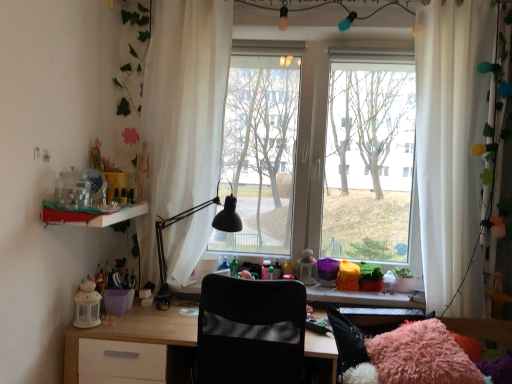
This screenshot has width=512, height=384. What do you see at coordinates (251, 332) in the screenshot?
I see `black mesh chair at center` at bounding box center [251, 332].

Locate an element on the screen. matte plastic shelf at left is located at coordinates (93, 216).

You are a GUI agent. You are given a task and a screenshot of the screen. Output one action in this format:
    pyautogui.click(x=<x>, y=<y>)
    Task: Click on the black matte desk lamp at center
    
    Given the screenshot: What is the action you would take?
    pyautogui.click(x=163, y=248)

What is the approximate width of black matte desk lamp at center?

black matte desk lamp at center is 19.95 inches wide.

In order to face light wood desk at center, should I rotate leftwards or rightwards?

You should look left and rotate roughly 6.264 degrees.

Measure the distance between point [175,341] and camera.

The distance of point [175,341] from camera is 6.08 feet.

What do you see at coordinates (321, 155) in the screenshot?
I see `transparent glass window at center` at bounding box center [321, 155].

In order to face white sheer curtain at center, arranged as the first curtain when viewed from the left, should I rotate leftwards or rightwards?

To face it directly, rotate left by 9.898 degrees.

Identify the location of white sheer curtain at right, the 1th curtain from the right. The image size is (512, 384). (451, 136).

At what (x,y) coordinates should I click in order to perform the action: click on black mesh chair at center. Please return your answer as a coordinate pair (x, y). The image size is (512, 384). Looking at the image, I should click on (251, 332).

Is white sheer curtain at right, the 1th curtain from the right, far away from transparent glass window at center?

They are positioned close to each other.

In terms of size, does white sheer curtain at right, the 1th curtain from the right, appear bigger or smaller than transparent glass window at center?

Clearly, white sheer curtain at right, the 1th curtain from the right, is smaller in size than transparent glass window at center.

Is light wood desk at center smaller than transparent glass window at center?

No.

Is light wood desk at center next to transparent glass window at center and touching it?

No.

Is light wood desk at center turned away from transparent glass window at center?

That's not correct — light wood desk at center is not looking away from transparent glass window at center.

Which object is more forward, light wood desk at center or transparent glass window at center?

light wood desk at center is more forward.

From the image's perspective, would you say transparent glass window at center is positioned over black matte desk lamp at center?

Yes.

Locate an element on the screen. This screenshot has height=384, width=512. table lamp that is on the left side of transparent glass window at center is located at coordinates (163, 248).

Considering the relative positions of transparent glass window at center and black matte desk lamp at center in the image provided, is transparent glass window at center to the left or to the right of black matte desk lamp at center?

Clearly, transparent glass window at center is on the right of black matte desk lamp at center in the image.

Is transparent glass window at center surrounding black matte desk lamp at center?

That's incorrect, black matte desk lamp at center is not inside transparent glass window at center.

Which is less distant, (x=457, y=81) or (x=367, y=325)?

Clearly, point (x=457, y=81) is closer to the camera than point (x=367, y=325).

From a real-world perspective, who is located higher, white sheer curtain at right, the 1th curtain from the right, or light wood desk at center?

white sheer curtain at right, the 1th curtain from the right, is physically above.

Which of these two, white sheer curtain at right, the 2th curtain when ordered from left to right, or light wood desk at center, is thinner?

white sheer curtain at right, the 2th curtain when ordered from left to right, is thinner.

Considering the relative sizes of white sheer curtain at right, the 1th curtain from the right, and light wood desk at center in the image provided, is white sheer curtain at right, the 1th curtain from the right, smaller than light wood desk at center?

Yes.

Consider the image. Considering their positions, is white sheer curtain at right, the 2th curtain when ordered from left to right, located in front of or behind white sheer curtain at center, arranged as the first curtain when viewed from the left?

Visually, white sheer curtain at right, the 2th curtain when ordered from left to right, is located in front of white sheer curtain at center, arranged as the first curtain when viewed from the left.

Which is correct: white sheer curtain at right, the 1th curtain from the right, is inside white sheer curtain at center, acting as the second curtain starting from the right, or outside of it?

white sheer curtain at right, the 1th curtain from the right, is located beyond the bounds of white sheer curtain at center, acting as the second curtain starting from the right.

From the picture: Would you say white sheer curtain at right, the 2th curtain when ordered from left to right, is to the left or to the right of white sheer curtain at center, arranged as the first curtain when viewed from the left, in the picture?

Based on their positions, white sheer curtain at right, the 2th curtain when ordered from left to right, is located to the right of white sheer curtain at center, arranged as the first curtain when viewed from the left.

Which point is more forward, (438, 156) or (162, 202)?

The point (438, 156) is more forward.

Is there a large distance between black matte desk lamp at center and transparent glass window at center?

black matte desk lamp at center is actually quite close to transparent glass window at center.

In the scene shown: Is black matte desk lamp at center looking in the opposite direction of transparent glass window at center?

No, black matte desk lamp at center's orientation is not away from transparent glass window at center.

Between black matte desk lamp at center and transparent glass window at center, which one appears on the right side from the viewer's perspective?

From the viewer's perspective, transparent glass window at center appears more on the right side.

The image size is (512, 384). Find the location of `table lamp that appears below the transparent glass window at center (from the image's perspective)`. table lamp that appears below the transparent glass window at center (from the image's perspective) is located at coordinates (163, 248).

This screenshot has width=512, height=384. I want to click on curtain that is the 2nd object located behind the black mesh chair at center, so click(183, 111).

Which object is positioned more to the left, black mesh chair at center or white sheer curtain at center, acting as the second curtain starting from the right?

From the viewer's perspective, white sheer curtain at center, acting as the second curtain starting from the right, appears more on the left side.

From a real-world perspective, is black mesh chair at center above or below white sheer curtain at center, acting as the second curtain starting from the right?

In terms of real-world spatial position, black mesh chair at center is below white sheer curtain at center, acting as the second curtain starting from the right.

The height and width of the screenshot is (384, 512). Find the location of `window behind the white sheer curtain at right, the 2th curtain when ordered from left to right`. window behind the white sheer curtain at right, the 2th curtain when ordered from left to right is located at coordinates (321, 155).

Where is `window that is above the light wood desk at center (from the image's perspective)`? The height and width of the screenshot is (384, 512). window that is above the light wood desk at center (from the image's perspective) is located at coordinates (321, 155).

Which object lies nearer to the anchor point matte plastic shelf at left, black matte desk lamp at center or transparent glass window at center?

The object closer to matte plastic shelf at left is black matte desk lamp at center.

Looking at this image, when comparing their distances from white sheer curtain at right, the 2th curtain when ordered from left to right, does matte plastic shelf at left or transparent glass window at center seem closer?

transparent glass window at center is closer to white sheer curtain at right, the 2th curtain when ordered from left to right.

When comparing their distances from black matte desk lamp at center, does white sheer curtain at right, the 1th curtain from the right, or light wood desk at center seem closer?

light wood desk at center lies closer to black matte desk lamp at center than the other object.

Based on the photo, looking at the image, which one is located further to light wood desk at center, transparent glass window at center or matte plastic shelf at left?

The object further to light wood desk at center is transparent glass window at center.

Looking at the image, which one is located further to transparent glass window at center, white sheer curtain at center, acting as the second curtain starting from the right, or black mesh chair at center?

black mesh chair at center.

From the image, which object appears to be farther from matte plastic shelf at left, white sheer curtain at right, the 2th curtain when ordered from left to right, or light wood desk at center?

white sheer curtain at right, the 2th curtain when ordered from left to right, is positioned further to the anchor matte plastic shelf at left.

Based on their spatial positions, is matte plastic shelf at left or black matte desk lamp at center further from light wood desk at center?

Among the two, matte plastic shelf at left is located further to light wood desk at center.

From the image, which object appears to be nearer to white sheer curtain at center, arranged as the first curtain when viewed from the left, black matte desk lamp at center or white sheer curtain at right, the 2th curtain when ordered from left to right?

Among the two, black matte desk lamp at center is located nearer to white sheer curtain at center, arranged as the first curtain when viewed from the left.

You are a GUI agent. You are given a task and a screenshot of the screen. Output one action in this format:
    pyautogui.click(x=<x>, y=<y>)
    Task: Click on the curtain between transparent glass window at center and light wood desk at center in the up-down direction
    The height and width of the screenshot is (384, 512).
    Given the screenshot: What is the action you would take?
    pyautogui.click(x=451, y=136)

The height and width of the screenshot is (384, 512). Find the location of `shelf between white sheer curtain at center, arranged as the first curtain when viewed from the left, and light wood desk at center vertically`. shelf between white sheer curtain at center, arranged as the first curtain when viewed from the left, and light wood desk at center vertically is located at coordinates (93, 216).

The width and height of the screenshot is (512, 384). I want to click on window between black matte desk lamp at center and white sheer curtain at right, the 1th curtain from the right, from left to right, so click(321, 155).

Locate an element on the screen. This screenshot has height=384, width=512. curtain located between matte plastic shelf at left and white sheer curtain at right, the 1th curtain from the right, in the left-right direction is located at coordinates (183, 111).